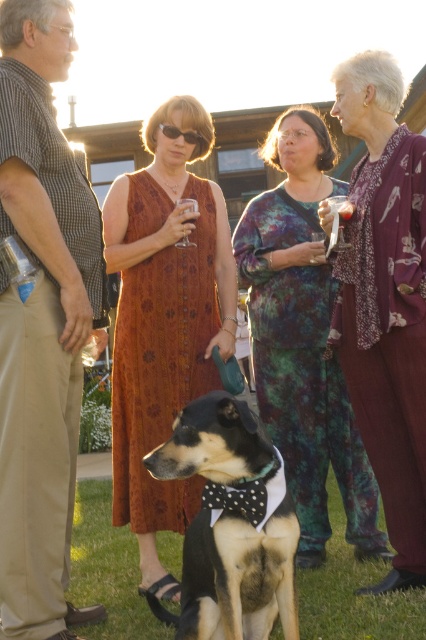
Question: Which object appears farthest from the camera in this image?

Choices:
 (A) khaki cotton pants at center
 (B) clear glass wine glass at center

Answer: (B)

Question: Can you confirm if khaki cotton pants at center is positioned to the left of purple floral dress at upper right?

Choices:
 (A) no
 (B) yes

Answer: (B)

Question: Which of the following is the farthest from the observer?

Choices:
 (A) (40, 502)
 (B) (187, 204)
 (C) (374, 336)

Answer: (B)

Question: Is the position of black and tan fur at center more distant than that of clear glass wine glass at center?

Choices:
 (A) no
 (B) yes

Answer: (A)

Question: Can you confirm if khaki cotton pants at center is positioned below clear glass wine glass at center?

Choices:
 (A) yes
 (B) no

Answer: (A)

Question: Which object is the closest to the clear glass wine glass at center?

Choices:
 (A) multicolored tie-dye dress at center
 (B) black and tan fur at center

Answer: (A)